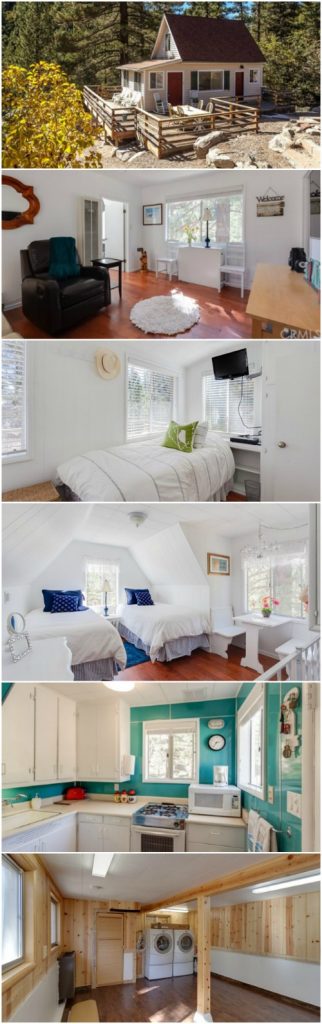
Locate an element on the screen. The width and height of the screenshot is (322, 1024). wood planks front side first image is located at coordinates (179, 117), (179, 127), (181, 132), (179, 137), (179, 150), (239, 112), (237, 118), (238, 124), (241, 129).